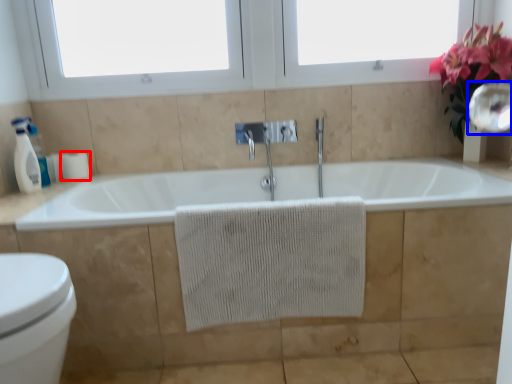
Question: Among these objects, which one is nearest to the camera, toilet paper (highlighted by a red box) or mirror (highlighted by a blue box)?

Choices:
 (A) toilet paper
 (B) mirror

Answer: (B)